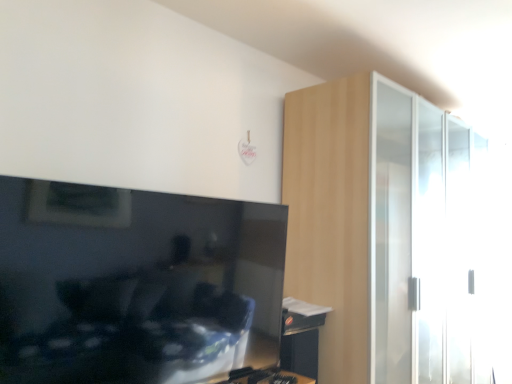
Question: Is light wood dresser at right aimed at wooden table at lower right?

Choices:
 (A) no
 (B) yes

Answer: (A)

Question: Is light wood dresser at right smaller than wooden table at lower right?

Choices:
 (A) no
 (B) yes

Answer: (A)

Question: Is light wood dresser at right bigger than wooden table at lower right?

Choices:
 (A) no
 (B) yes

Answer: (B)

Question: Is light wood dresser at right far from wooden table at lower right?

Choices:
 (A) no
 (B) yes

Answer: (A)

Question: Can you confirm if light wood dresser at right is positioned to the right of wooden table at lower right?

Choices:
 (A) yes
 (B) no

Answer: (A)

Question: Is light wood dresser at right positioned in front of wooden table at lower right?

Choices:
 (A) yes
 (B) no

Answer: (A)

Question: From the image's perspective, is matte black tv at left beneath wooden table at lower right?

Choices:
 (A) no
 (B) yes

Answer: (A)

Question: Would you consider matte black tv at left to be distant from wooden table at lower right?

Choices:
 (A) no
 (B) yes

Answer: (A)

Question: Can you confirm if matte black tv at left is positioned to the right of wooden table at lower right?

Choices:
 (A) yes
 (B) no

Answer: (B)

Question: Is matte black tv at left oriented away from wooden table at lower right?

Choices:
 (A) yes
 (B) no

Answer: (B)

Question: Does matte black tv at left come behind wooden table at lower right?

Choices:
 (A) no
 (B) yes

Answer: (A)

Question: From a real-world perspective, is matte black tv at left physically above wooden table at lower right?

Choices:
 (A) no
 (B) yes

Answer: (B)

Question: Can you confirm if matte black tv at left is taller than light wood dresser at right?

Choices:
 (A) no
 (B) yes

Answer: (A)